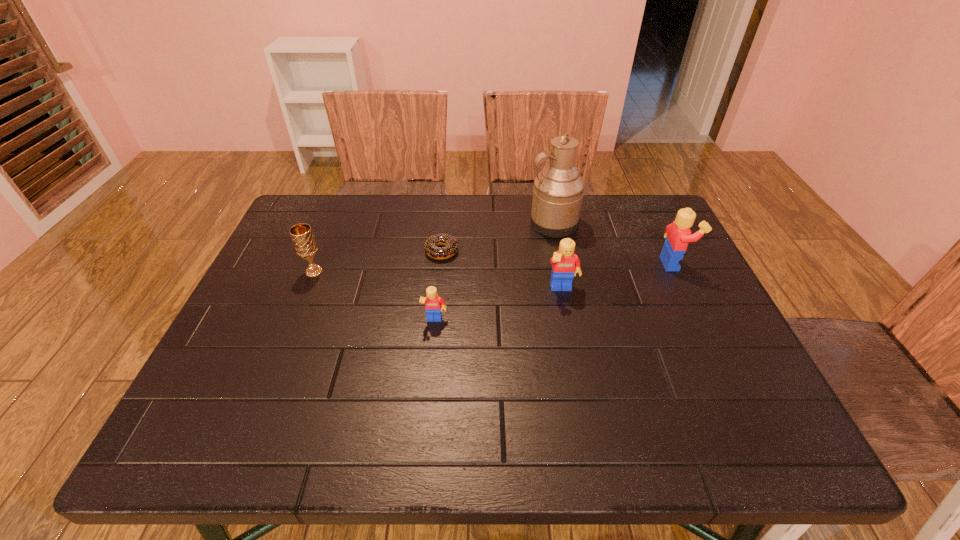
What are the coordinates of `vacant space at the near edge of the desktop` in the screenshot? It's located at (557, 380).

In the image, there is a desktop. Where is `vacant space at the left edge`? The height and width of the screenshot is (540, 960). vacant space at the left edge is located at coordinates (276, 284).

This screenshot has width=960, height=540. Find the location of `vacant space at the right edge of the desktop`. vacant space at the right edge of the desktop is located at coordinates pyautogui.click(x=636, y=262).

The image size is (960, 540). In the image, there is a desktop. Identify the location of vacant space at the far right corner. (636, 219).

Locate an element on the screen. Image resolution: width=960 pixels, height=540 pixels. vacant area that lies between the farthest object and the doughnut is located at coordinates (497, 237).

You are a GUI agent. You are given a task and a screenshot of the screen. Output one action in this format:
    pyautogui.click(x=<x>, y=<y>)
    Task: Click on the free area in between the shortest object and the fifth farthest object
    The width and height of the screenshot is (960, 540).
    Given the screenshot: What is the action you would take?
    pyautogui.click(x=502, y=271)

Where is `free spot between the doughnut and the chalice`? This screenshot has height=540, width=960. free spot between the doughnut and the chalice is located at coordinates (378, 261).

Find the location of a particular element. This screenshot has height=540, width=960. unoccupied position between the nearest Lego and the rightmost Lego is located at coordinates (554, 292).

This screenshot has width=960, height=540. I want to click on vacant point located between the rightmost Lego and the pitcher, so click(613, 243).

Find the location of a particular element. The height and width of the screenshot is (540, 960). vacant area that lies between the second nearest object and the leftmost object is located at coordinates (438, 281).